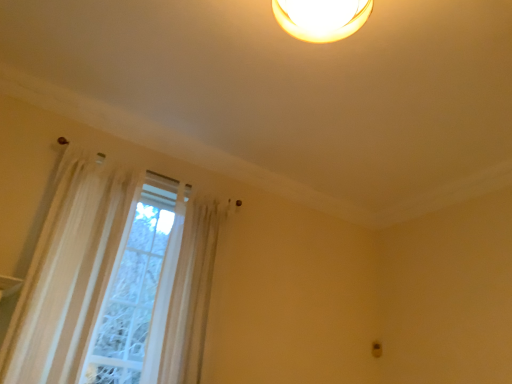
Question: Can you confirm if translucent white curtain at left is thinner than sheer white curtain at left?

Choices:
 (A) yes
 (B) no

Answer: (B)

Question: Is translucent white curtain at left bigger than sheer white curtain at left?

Choices:
 (A) yes
 (B) no

Answer: (A)

Question: Considering the relative sizes of translucent white curtain at left and sheer white curtain at left in the image provided, is translucent white curtain at left shorter than sheer white curtain at left?

Choices:
 (A) no
 (B) yes

Answer: (B)

Question: Is translucent white curtain at left touching sheer white curtain at left?

Choices:
 (A) no
 (B) yes

Answer: (A)

Question: Would you say translucent white curtain at left is outside sheer white curtain at left?

Choices:
 (A) yes
 (B) no

Answer: (A)

Question: Can you confirm if translucent white curtain at left is positioned to the left of sheer white curtain at left?

Choices:
 (A) yes
 (B) no

Answer: (B)

Question: Does sheer white curtain at left have a greater height compared to translucent white curtain at left?

Choices:
 (A) yes
 (B) no

Answer: (A)

Question: Are sheer white curtain at left and translucent white curtain at left located far from each other?

Choices:
 (A) yes
 (B) no

Answer: (B)

Question: From the image's perspective, is sheer white curtain at left beneath translucent white curtain at left?

Choices:
 (A) no
 (B) yes

Answer: (A)

Question: Is sheer white curtain at left oriented towards translucent white curtain at left?

Choices:
 (A) no
 (B) yes

Answer: (A)

Question: Is sheer white curtain at left positioned beyond the bounds of translucent white curtain at left?

Choices:
 (A) no
 (B) yes

Answer: (B)

Question: Can you confirm if sheer white curtain at left is positioned to the left of translucent white curtain at left?

Choices:
 (A) yes
 (B) no

Answer: (A)

Question: Do you think sheer white curtain at left is within translucent white curtain at left, or outside of it?

Choices:
 (A) outside
 (B) inside

Answer: (A)